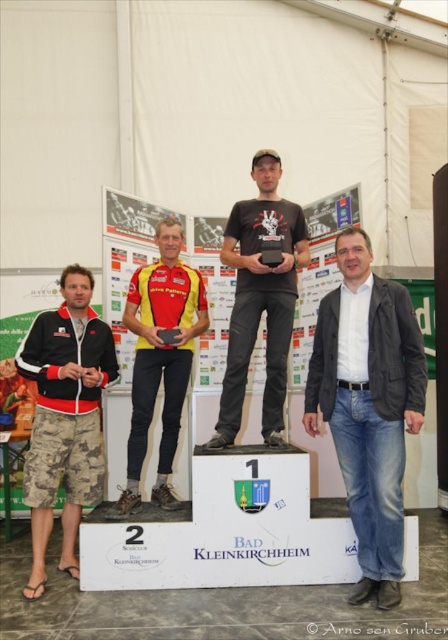
Question: Is dark gray blazer at center above yellow jersey at center?

Choices:
 (A) yes
 (B) no

Answer: (B)

Question: Is dark gray blazer at center smaller than camouflage shorts at lower left?

Choices:
 (A) yes
 (B) no

Answer: (A)

Question: Considering the real-world distances, which object is farthest from the black matte t-shirt at center?

Choices:
 (A) camouflage shorts at lower left
 (B) dark gray blazer at center

Answer: (A)

Question: Can you confirm if camouflage shorts at lower left is positioned to the right of black matte t-shirt at center?

Choices:
 (A) yes
 (B) no

Answer: (B)

Question: Which of these objects is positioned closest to the camouflage shorts at lower left?

Choices:
 (A) black matte t-shirt at center
 (B) dark gray blazer at center
 (C) yellow jersey at center

Answer: (C)

Question: Estimate the real-world distances between objects in this image. Which object is farther from the black matte t-shirt at center?

Choices:
 (A) yellow jersey at center
 (B) dark gray blazer at center

Answer: (B)